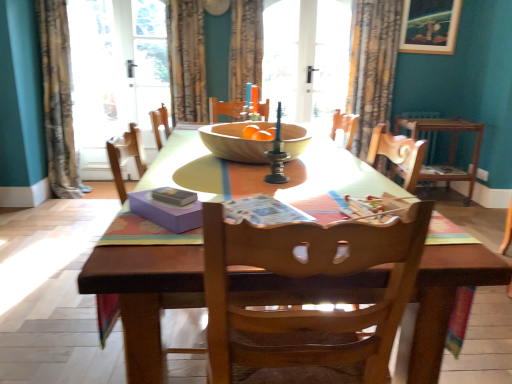
Where is `spots to the right of matte purple magazine at center, the second magazine from the right`? spots to the right of matte purple magazine at center, the second magazine from the right is located at coordinates (252, 208).